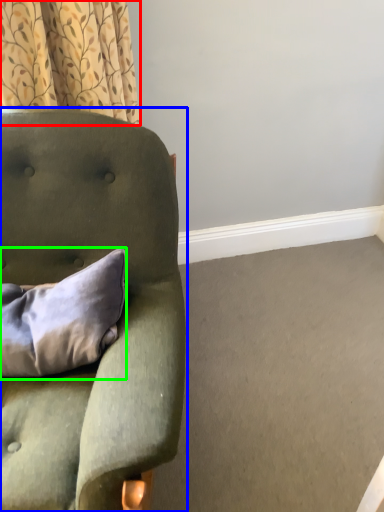
Question: Which is farther away from curtain (highlighted by a red box)? chair (highlighted by a blue box) or pillow (highlighted by a green box)?

Choices:
 (A) chair
 (B) pillow

Answer: (B)